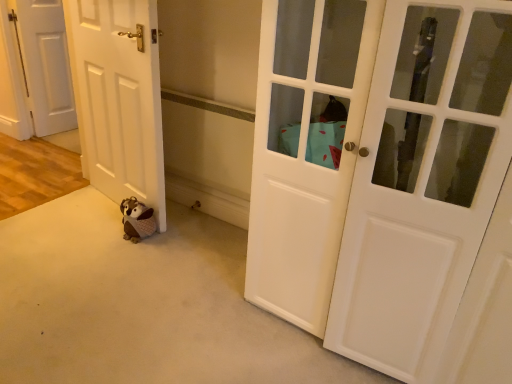
This screenshot has width=512, height=384. Find the location of `vacant space to the right of plush brown bear at lower left`. vacant space to the right of plush brown bear at lower left is located at coordinates (174, 239).